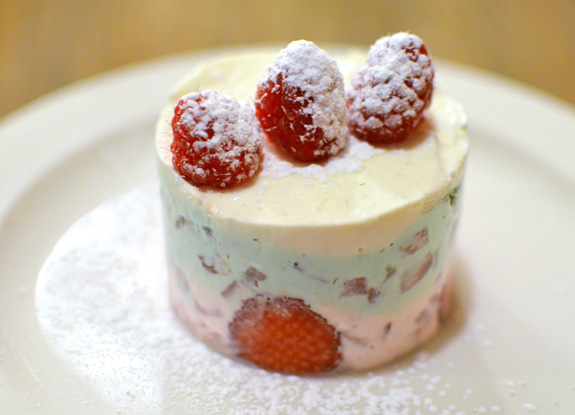
The height and width of the screenshot is (415, 575). I want to click on white place under cake, so click(105, 120).